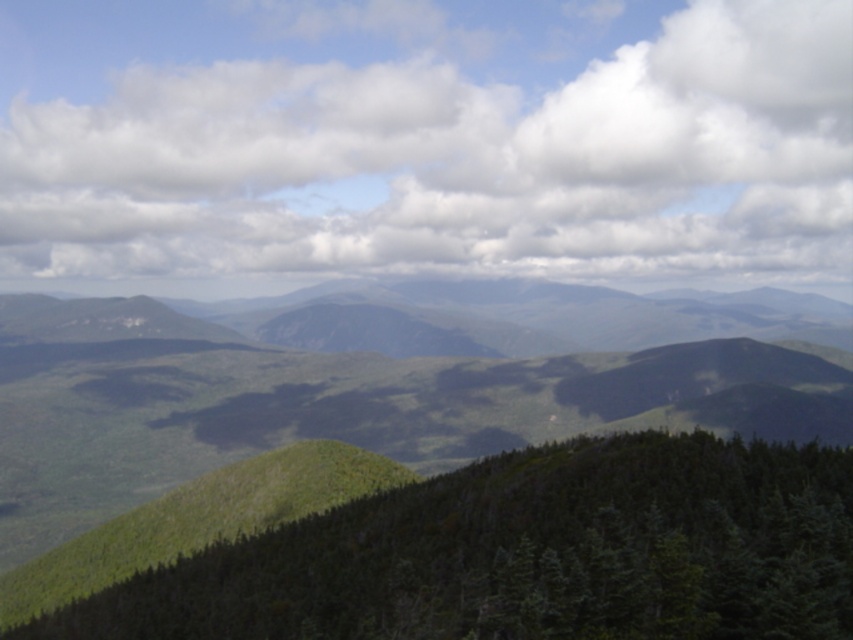
Question: Which point is closer to the camera?

Choices:
 (A) (614, 513)
 (B) (180, 100)

Answer: (A)

Question: Which object is closer to the camera taking this photo?

Choices:
 (A) green matte tree at center
 (B) white fluffy cloud at upper center

Answer: (A)

Question: From the image, what is the correct spatial relationship of white fluffy cloud at upper center in relation to green matte tree at center?

Choices:
 (A) above
 (B) below

Answer: (A)

Question: Which object appears closest to the camera in this image?

Choices:
 (A) green matte tree at center
 (B) white fluffy cloud at upper center

Answer: (A)

Question: Is white fluffy cloud at upper center smaller than green matte tree at center?

Choices:
 (A) yes
 (B) no

Answer: (B)

Question: Can you confirm if white fluffy cloud at upper center is positioned above green matte tree at center?

Choices:
 (A) no
 (B) yes

Answer: (B)